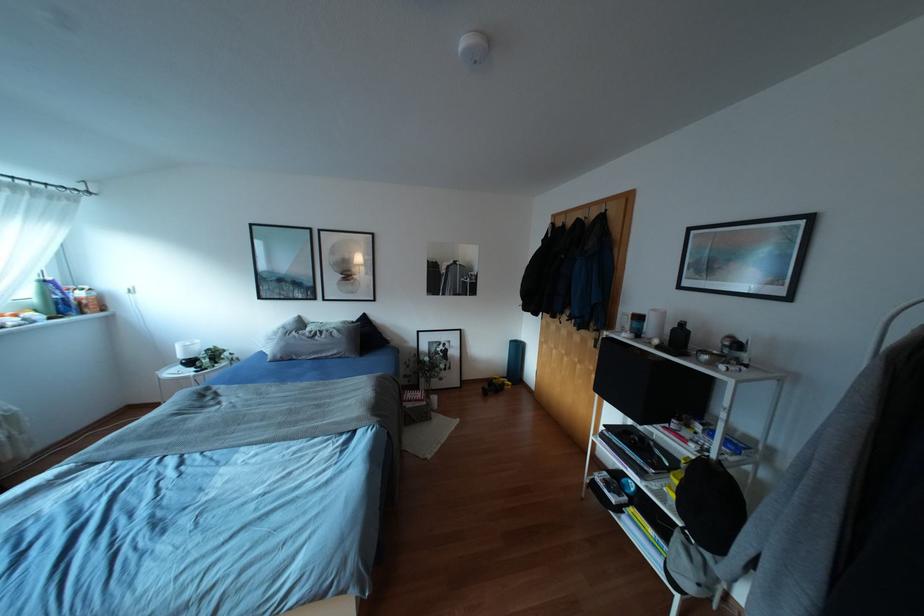
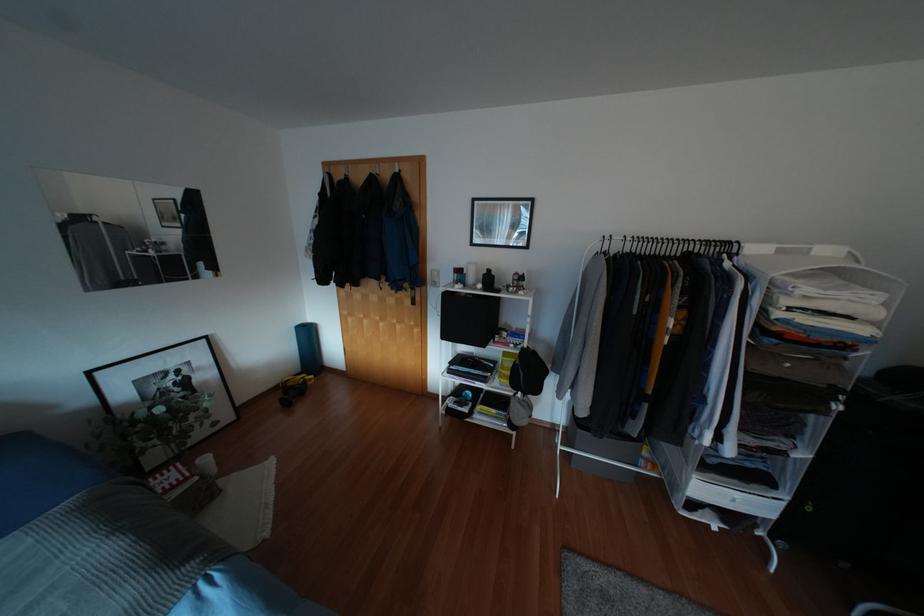
Question: The first image is from the beginning of the video and the second image is from the end. How did the camera likely rotate when shooting the video?

Choices:
 (A) Left
 (B) Right
 (C) Up
 (D) Down

Answer: (B)